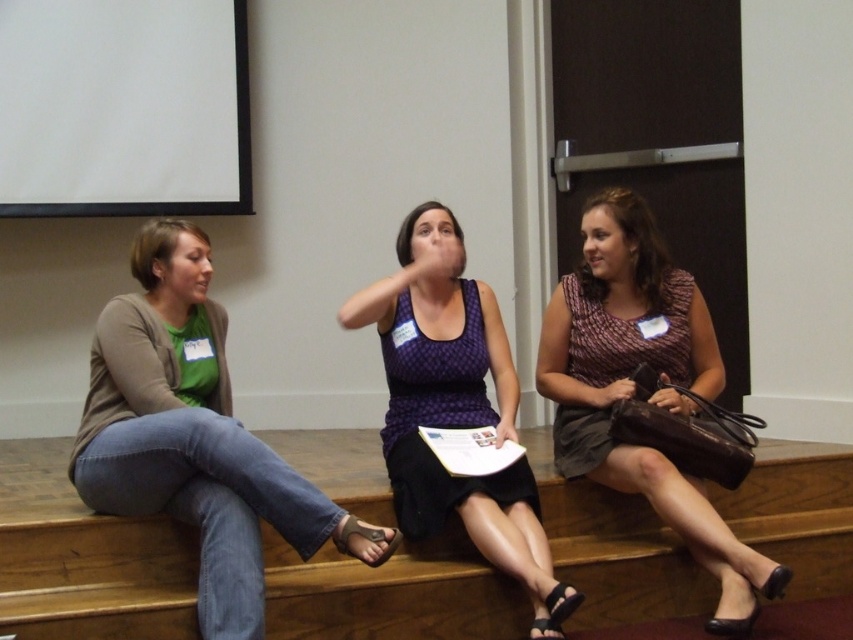
Question: Among these points, which one is farthest from the camera?

Choices:
 (A) (430, 216)
 (B) (181, 173)
 (C) (838, 467)

Answer: (B)

Question: Is brown wooden stairs at center bigger than purple dotted tank top at center?

Choices:
 (A) yes
 (B) no

Answer: (B)

Question: Which object appears farthest from the camera in this image?

Choices:
 (A) purple dotted tank top at center
 (B) matte brown dress at right
 (C) white matte projection screen at upper left
 (D) brown wooden stairs at center

Answer: (C)

Question: Can you confirm if white matte projection screen at upper left is thinner than matte brown dress at right?

Choices:
 (A) no
 (B) yes

Answer: (A)

Question: From the image, what is the correct spatial relationship of brown wooden stairs at center in relation to white matte projection screen at upper left?

Choices:
 (A) left
 (B) right

Answer: (B)

Question: Which point is closer to the camera taking this photo?

Choices:
 (A) (53, 17)
 (B) (480, 339)
 (C) (740, 545)

Answer: (C)